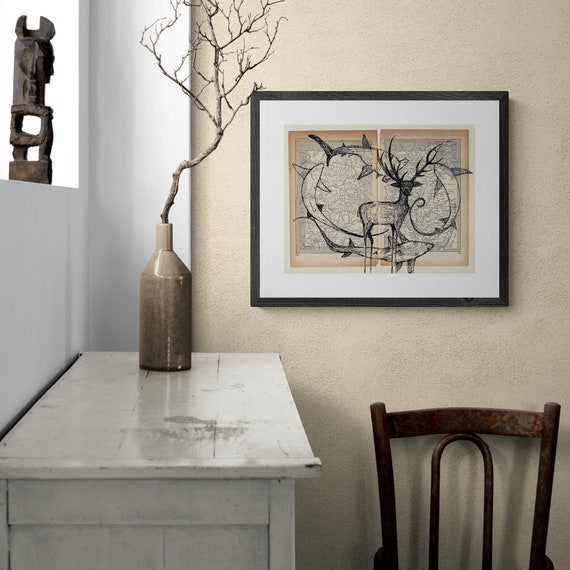
You are a GUI agent. You are given a task and a screenshot of the screen. Output one action in this format:
    pyautogui.click(x=<x>, y=<y>)
    Task: Click on the 1 table
    
    Given the screenshot: What is the action you would take?
    pyautogui.click(x=89, y=439)